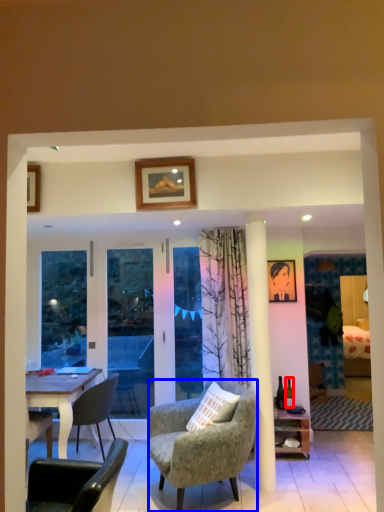
Question: Which of the following is the closest to the observer, bottle (highlighted by a red box) or chair (highlighted by a blue box)?

Choices:
 (A) bottle
 (B) chair

Answer: (B)